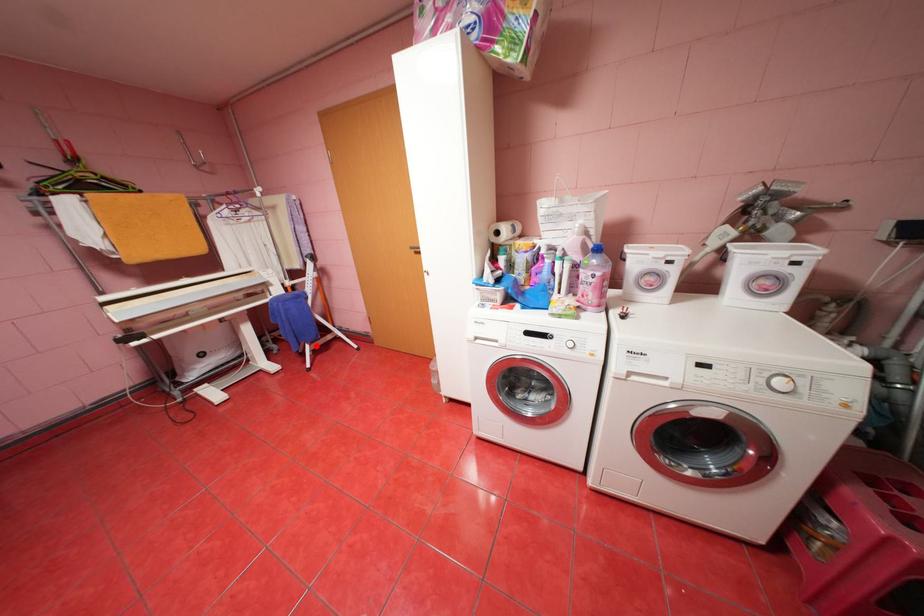
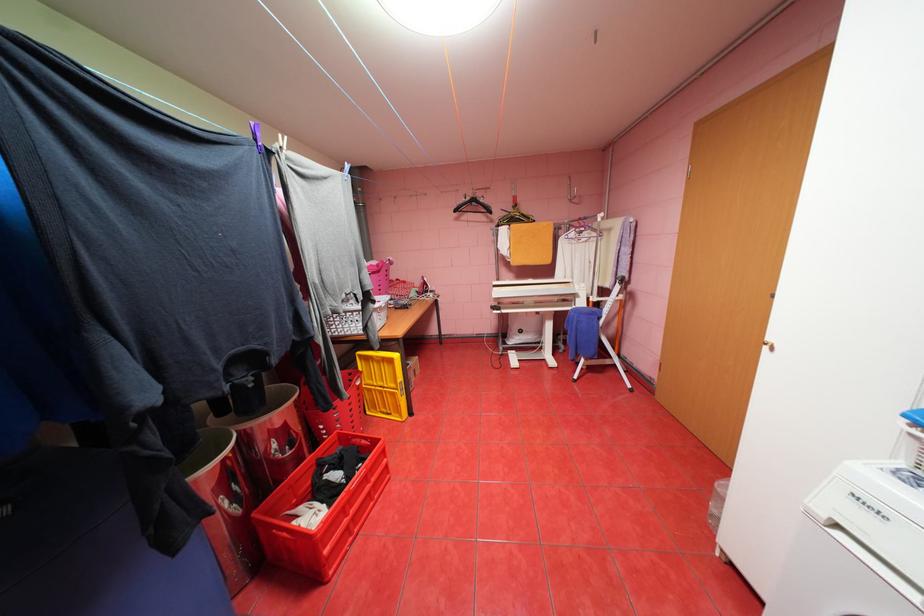
Locate, in the second image, the point that corresponds to the highlighted location in the first image.

(591, 360)